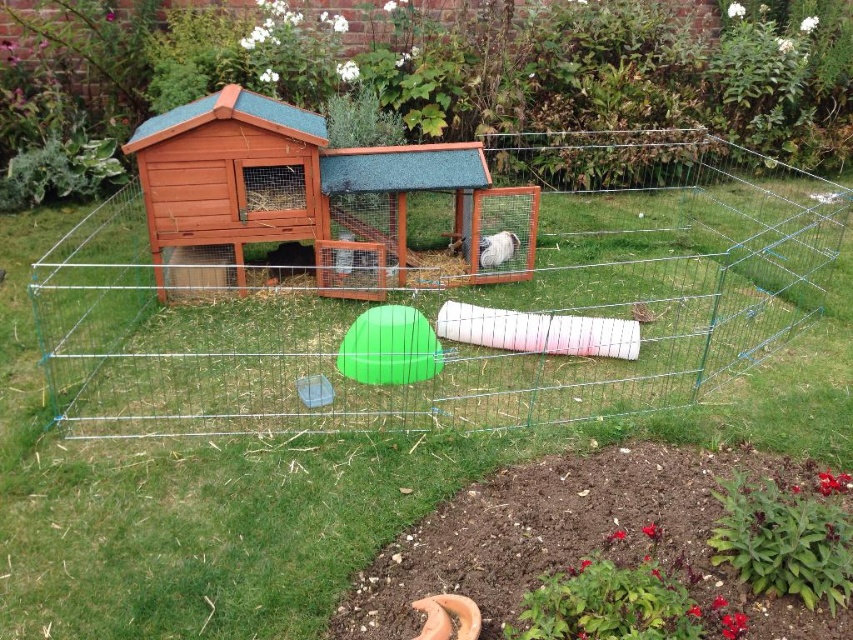
You are standing in the backyard and want to place a new feeding station. The feeding station requires a space that is not occupied by the green wire fence at center. Where should you place it?

The green wire fence at center is located at point (457, 298). To place the feeding station, choose an area outside of this coordinate to avoid the fence.

You are a small animal owner who wants to place a new feeding tray in the wooden hut at center and the brown wooden rabbit hutch at center. Which structure can accommodate a larger feeding tray?

The wooden hut at center has a larger size compared to the brown wooden rabbit hutch at center, so it can accommodate a larger feeding tray.